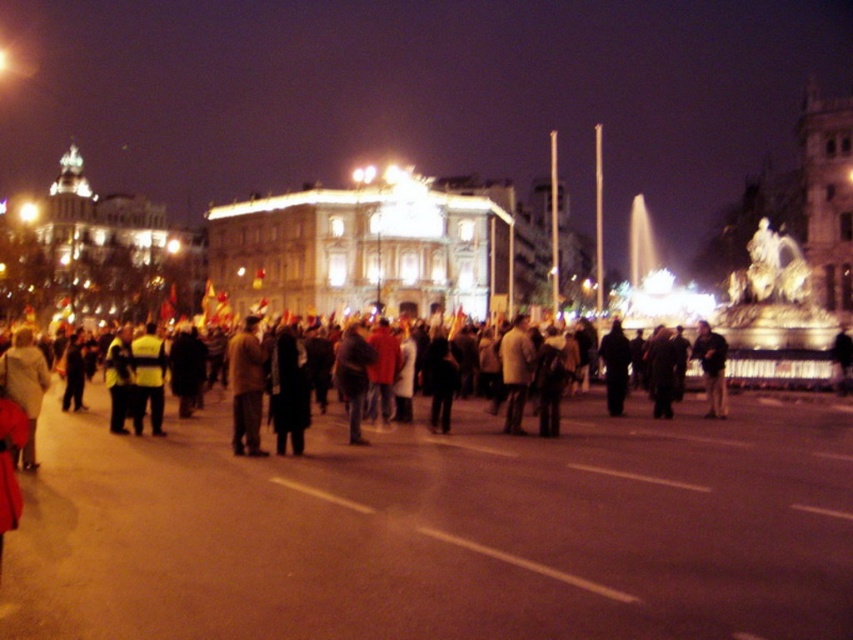
You are a photographer trying to capture a clear shot of the dark gray jacket at center without the dark gray clothing at center blocking it. Based on their sizes, is this possible?

The dark gray clothing at center might be wider than dark gray jacket at center, so there is a possibility that the dark gray clothing at center could block the view of the dark gray jacket at center. Adjust your position to ensure the dark gray jacket at center is visible.

You are at the center of the crowd in the public square and notice two items of dark gray color. One is labeled as dark gray clothing at center and the other as dark gray jacket at center. Which of these two items is positioned more to the left?

The dark gray clothing at center is positioned to the left of the dark gray jacket at center, so the dark gray clothing at center is more to the left.